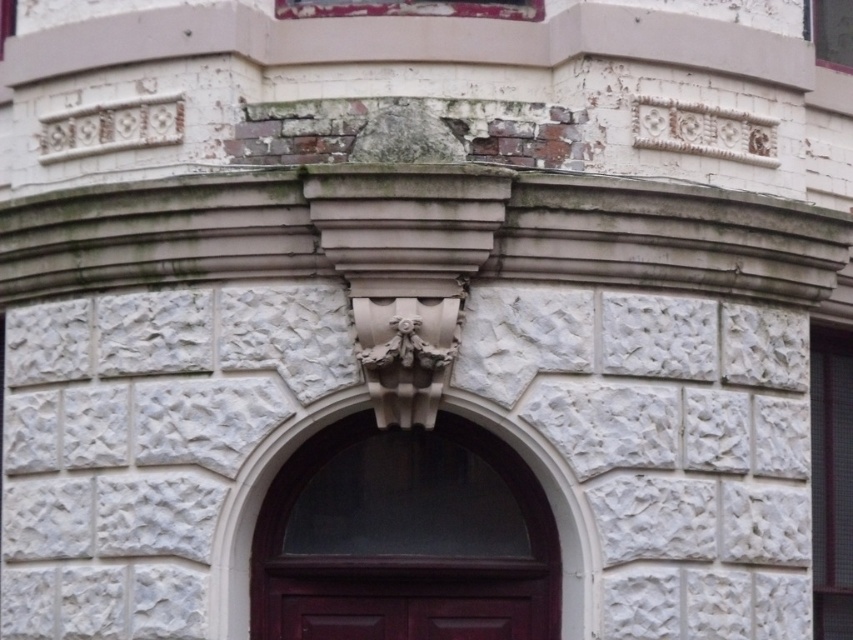
You are standing in front of the old building and want to enter through the dark wood door at center. Which side of the white stone arch at center should you approach from to find the door?

The dark wood door at center is to the left of the white stone arch at center, so you should approach from the left side of the white stone arch at center to find the door.

You are an architect examining the building facade. You need to determine which object occupies more space in the image. Based on the scene, which is larger between the dark wood door at center and the white stone arch at center?

The dark wood door at center is bigger than the white stone arch at center, so the dark wood door at center occupies more space in the image.